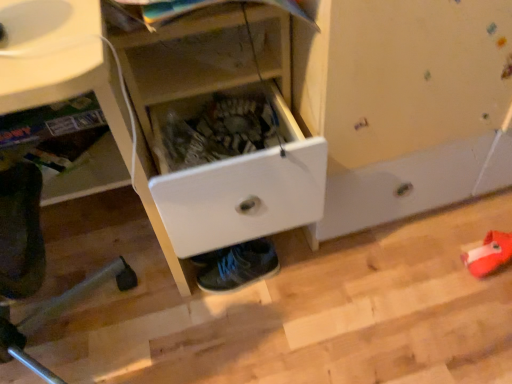
Image resolution: width=512 pixels, height=384 pixels. Identify the location of shiny blue sneakers at lower center. (236, 266).

What do you see at coordinates (222, 147) in the screenshot? I see `white plastic drawer at center` at bounding box center [222, 147].

Identify the location of white plastic drawer at center. (222, 147).

The height and width of the screenshot is (384, 512). Identify the location of shiny blue sneakers at lower center. (236, 266).

Is white plastic drawer at center not inside shiny blue sneakers at lower center?

white plastic drawer at center is positioned outside shiny blue sneakers at lower center.

From the picture: Is white plastic drawer at center next to shiny blue sneakers at lower center?

No, white plastic drawer at center is not with shiny blue sneakers at lower center.

Is white plastic drawer at center smaller than shiny blue sneakers at lower center?

No, white plastic drawer at center is not smaller than shiny blue sneakers at lower center.

Visually, is shiny blue sneakers at lower center positioned to the left or to the right of white plastic drawer at center?

shiny blue sneakers at lower center is positioned on white plastic drawer at center's right side.

What's the angular difference between shiny blue sneakers at lower center and white plastic drawer at center's facing directions?

The angle between the facing direction of shiny blue sneakers at lower center and the facing direction of white plastic drawer at center is 1.9 degrees.

Considering the sizes of objects shiny blue sneakers at lower center and white plastic drawer at center in the image provided, who is shorter, shiny blue sneakers at lower center or white plastic drawer at center?

With less height is shiny blue sneakers at lower center.

The image size is (512, 384). Identify the location of computer desk below the white plastic drawer at center (from the image's perspective). (61, 61).

Is white plastic drawer at lower center aimed at white plastic drawer at center?

No, white plastic drawer at lower center is not aimed at white plastic drawer at center.

From the image's perspective, which is below, white plastic drawer at lower center or white plastic drawer at center?

white plastic drawer at lower center is shown below in the image.

From a real-world perspective, does white plastic drawer at lower center sit lower than white plastic drawer at center?

No, from a real-world perspective, white plastic drawer at lower center is not under white plastic drawer at center.

I want to click on drawer that appears on the right of white plastic drawer at lower center, so click(x=244, y=193).

Does white plastic drawer at center contain white plastic drawer at lower center?

Definitely not — white plastic drawer at lower center is not inside white plastic drawer at center.

In terms of height, does white plastic drawer at center look taller or shorter compared to white plastic drawer at lower center?

Clearly, white plastic drawer at center is shorter compared to white plastic drawer at lower center.

Is white plastic drawer at center bigger than white plastic drawer at lower center?

Actually, white plastic drawer at center might be smaller than white plastic drawer at lower center.

Does white plastic drawer at center appear on the left side of white plastic drawer at lower center?

No.

Measure the distance between white plastic drawer at center and white plastic drawer at lower center.

The distance of white plastic drawer at center from white plastic drawer at lower center is 6.58 inches.

Which point is more distant from viewer, (x=216, y=250) or (x=94, y=25)?

The point (x=216, y=250) is farther.

Who is smaller, white plastic drawer at center or white plastic drawer at lower center?

white plastic drawer at center.

From the image's perspective, which is above, shiny blue sneakers at lower center or white plastic drawer at center?

white plastic drawer at center, from the image's perspective.

Would you say shiny blue sneakers at lower center is to the left or to the right of white plastic drawer at center in the picture?

In the image, shiny blue sneakers at lower center appears on the right side of white plastic drawer at center.

Is shiny blue sneakers at lower center facing towards white plastic drawer at center?

No, shiny blue sneakers at lower center does not turn towards white plastic drawer at center.

Is point (206, 254) closer or farther from the camera than point (289, 146)?

Clearly, point (206, 254) is more distant from the camera than point (289, 146).

Who is taller, shiny blue sneakers at lower center or white plastic drawer at lower center?

white plastic drawer at lower center is taller.

Identify the location of computer desk on the left of shiny blue sneakers at lower center. The width and height of the screenshot is (512, 384). (61, 61).

Is shiny blue sneakers at lower center to the right of white plastic drawer at lower center from the viewer's perspective?

Correct, you'll find shiny blue sneakers at lower center to the right of white plastic drawer at lower center.

I want to click on footwear below the white plastic drawer at center (from the image's perspective), so click(x=236, y=266).

Identify the location of cabinetry above the shiny blue sneakers at lower center (from the image's perspective). This screenshot has width=512, height=384. (222, 147).

Considering their positions, is white plastic drawer at center positioned further to shiny blue sneakers at lower center than white plastic drawer at center?

The object further to shiny blue sneakers at lower center is white plastic drawer at center.

Considering their positions, is white plastic drawer at lower center positioned closer to shiny blue sneakers at lower center than white plastic drawer at center?

Based on the image, white plastic drawer at center appears to be nearer to shiny blue sneakers at lower center.

Estimate the real-world distances between objects in this image. Which object is closer to shiny blue sneakers at lower center, white plastic drawer at center or white plastic drawer at center?

white plastic drawer at center is positioned closer to the anchor shiny blue sneakers at lower center.

Considering their positions, is white plastic drawer at center positioned further to white plastic drawer at center than shiny blue sneakers at lower center?

shiny blue sneakers at lower center.

Based on their spatial positions, is white plastic drawer at center or white plastic drawer at lower center closer to shiny blue sneakers at lower center?

white plastic drawer at center lies closer to shiny blue sneakers at lower center than the other object.

Based on their spatial positions, is white plastic drawer at center or white plastic drawer at lower center closer to white plastic drawer at center?

The object closer to white plastic drawer at center is white plastic drawer at center.

When comparing their distances from white plastic drawer at center, does shiny blue sneakers at lower center or white plastic drawer at lower center seem further?

shiny blue sneakers at lower center is positioned further to the anchor white plastic drawer at center.

Based on their spatial positions, is white plastic drawer at center or shiny blue sneakers at lower center further from white plastic drawer at lower center?

The object further to white plastic drawer at lower center is shiny blue sneakers at lower center.

Where is `cabinetry positioned between white plastic drawer at lower center and white plastic drawer at center from near to far`? cabinetry positioned between white plastic drawer at lower center and white plastic drawer at center from near to far is located at coordinates (222, 147).

Locate an element on the screen. cabinetry between white plastic drawer at lower center and shiny blue sneakers at lower center in the front-back direction is located at coordinates tap(222, 147).

The width and height of the screenshot is (512, 384). Find the location of `drawer between white plastic drawer at center and shiny blue sneakers at lower center from front to back`. drawer between white plastic drawer at center and shiny blue sneakers at lower center from front to back is located at coordinates (244, 193).

The height and width of the screenshot is (384, 512). What are the coordinates of `drawer between white plastic drawer at lower center and shiny blue sneakers at lower center along the z-axis` in the screenshot? It's located at point(244,193).